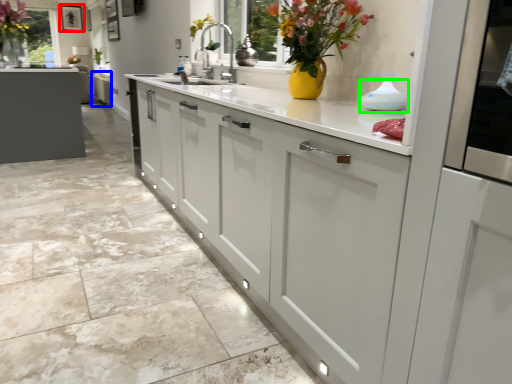
Question: Which object is positioned farthest from picture frame (highlighted by a red box)? Select from cabinetry (highlighted by a blue box) and appliance (highlighted by a green box).

Choices:
 (A) cabinetry
 (B) appliance

Answer: (B)